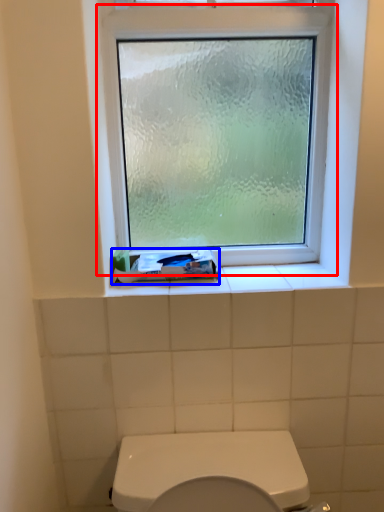
Question: Which object is further to the camera taking this photo, window (highlighted by a red box) or toothpaste (highlighted by a blue box)?

Choices:
 (A) window
 (B) toothpaste

Answer: (B)